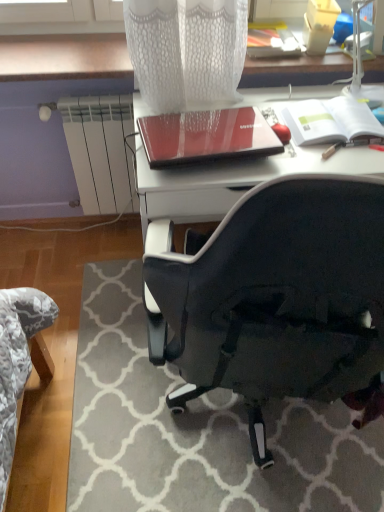
Question: Considering the relative positions of white matte notebook at upper right, the 1th notebook from the right, and white mesh table lamp at upper right in the image provided, is white matte notebook at upper right, the 1th notebook from the right, in front of white mesh table lamp at upper right?

Choices:
 (A) yes
 (B) no

Answer: (B)

Question: Considering the relative sizes of white matte notebook at upper right, the 2th notebook in the left-to-right sequence, and white mesh table lamp at upper right in the image provided, is white matte notebook at upper right, the 2th notebook in the left-to-right sequence, smaller than white mesh table lamp at upper right?

Choices:
 (A) no
 (B) yes

Answer: (B)

Question: Is white matte notebook at upper right, the 2th notebook in the left-to-right sequence, facing away from white mesh table lamp at upper right?

Choices:
 (A) no
 (B) yes

Answer: (A)

Question: From the image's perspective, is white matte notebook at upper right, the 2th notebook in the left-to-right sequence, above white mesh table lamp at upper right?

Choices:
 (A) no
 (B) yes

Answer: (A)

Question: From a real-world perspective, is white matte notebook at upper right, the 2th notebook in the left-to-right sequence, physically below white mesh table lamp at upper right?

Choices:
 (A) no
 (B) yes

Answer: (B)

Question: Is white mesh table lamp at upper right taller or shorter than white matte notebook at upper right, the 1th notebook from the right?

Choices:
 (A) tall
 (B) short

Answer: (A)

Question: Considering their positions, is white mesh table lamp at upper right located in front of or behind white matte notebook at upper right, the 2th notebook in the left-to-right sequence?

Choices:
 (A) front
 (B) behind

Answer: (A)

Question: Is white mesh table lamp at upper right spatially inside white matte notebook at upper right, the 2th notebook in the left-to-right sequence, or outside of it?

Choices:
 (A) inside
 (B) outside

Answer: (B)

Question: From a real-world perspective, is white mesh table lamp at upper right physically located above or below white matte notebook at upper right, the 2th notebook in the left-to-right sequence?

Choices:
 (A) above
 (B) below

Answer: (A)

Question: From the image's perspective, is white mesh table lamp at upper right positioned above or below black fabric chair at lower right?

Choices:
 (A) below
 (B) above

Answer: (B)

Question: Is white mesh table lamp at upper right inside the boundaries of black fabric chair at lower right, or outside?

Choices:
 (A) inside
 (B) outside

Answer: (B)

Question: Is point (352, 93) positioned closer to the camera than point (153, 318)?

Choices:
 (A) closer
 (B) farther

Answer: (B)

Question: In the image, is white mesh table lamp at upper right positioned in front of or behind black fabric chair at lower right?

Choices:
 (A) front
 (B) behind

Answer: (B)

Question: Considering the positions of white matte notebook at upper right, the 2th notebook in the left-to-right sequence, and white mesh table lamp at upper right in the image, is white matte notebook at upper right, the 2th notebook in the left-to-right sequence, bigger or smaller than white mesh table lamp at upper right?

Choices:
 (A) big
 (B) small

Answer: (B)

Question: Is white matte notebook at upper right, the 1th notebook from the right, taller or shorter than white mesh table lamp at upper right?

Choices:
 (A) short
 (B) tall

Answer: (A)